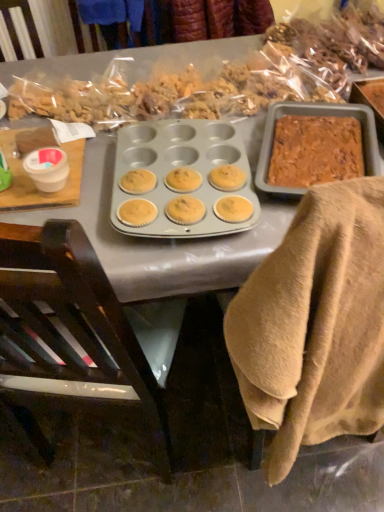
What is the approximate width of beige cotton towel at lower right?

It is 6.19 inches.

Identify the location of beige cotton towel at lower right. The image size is (384, 512). (315, 324).

What do you see at coordinates (315, 324) in the screenshot? Image resolution: width=384 pixels, height=512 pixels. I see `beige cotton towel at lower right` at bounding box center [315, 324].

What are the coordinates of `beige cotton towel at lower right` in the screenshot? It's located at (315, 324).